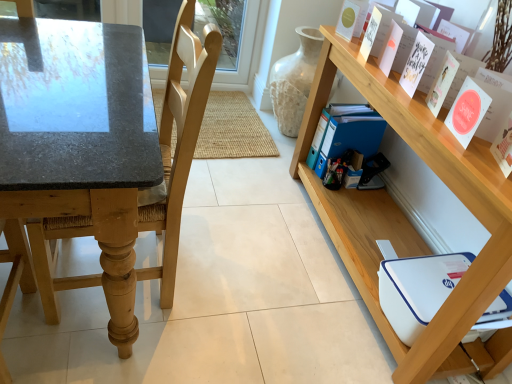
At what (x,y) coordinates should I click in order to perform the action: click on free region on the left part of wooden shelf at upper right. Please return your answer as a coordinate pair (x, y). Image resolution: width=512 pixels, height=384 pixels. Looking at the image, I should click on (251, 227).